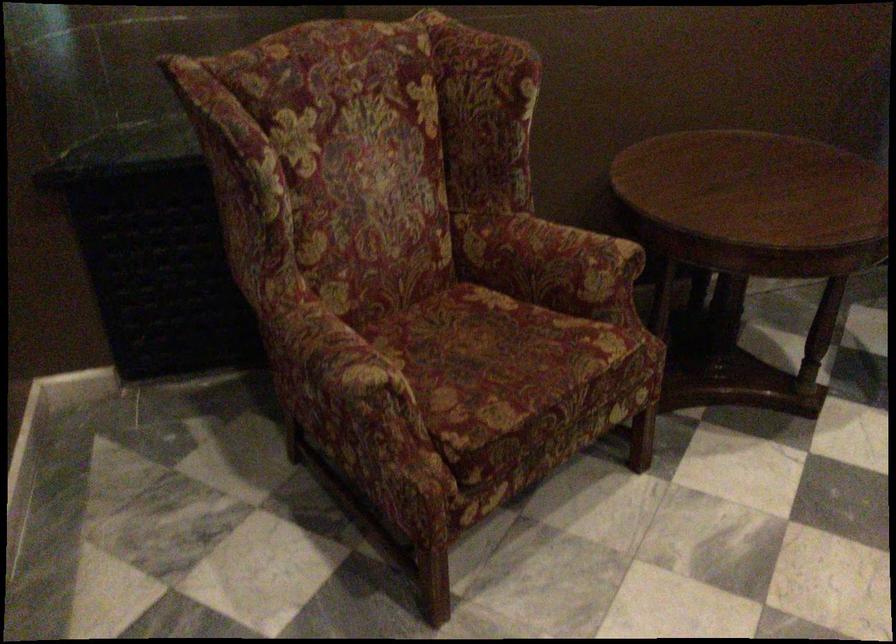
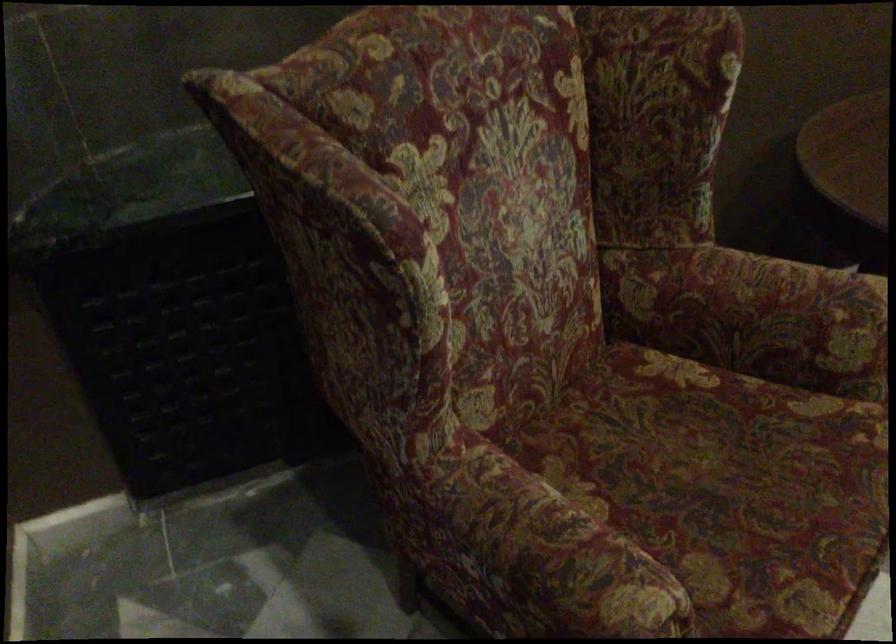
Question: How did the camera likely rotate?

Choices:
 (A) Left
 (B) Right
 (C) Up
 (D) Down

Answer: (D)